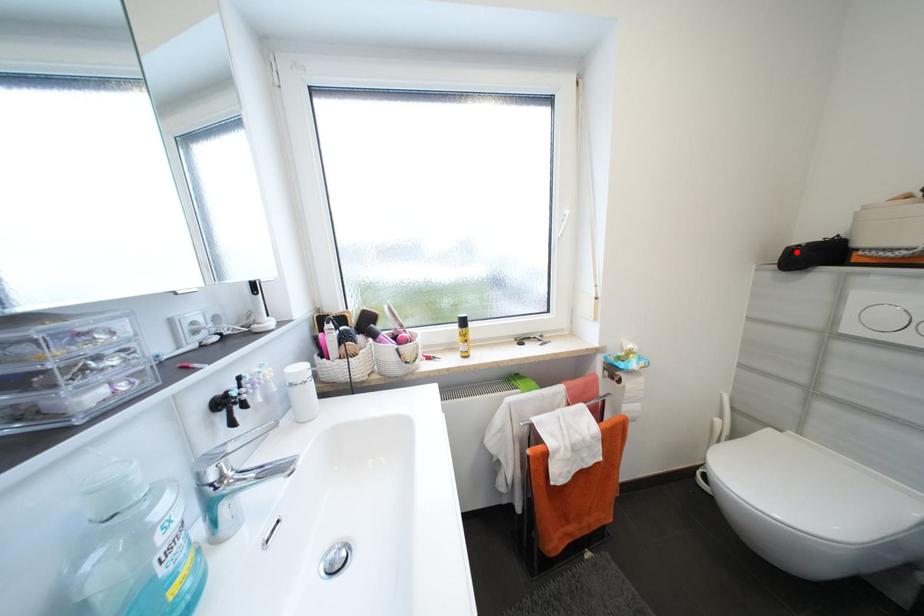
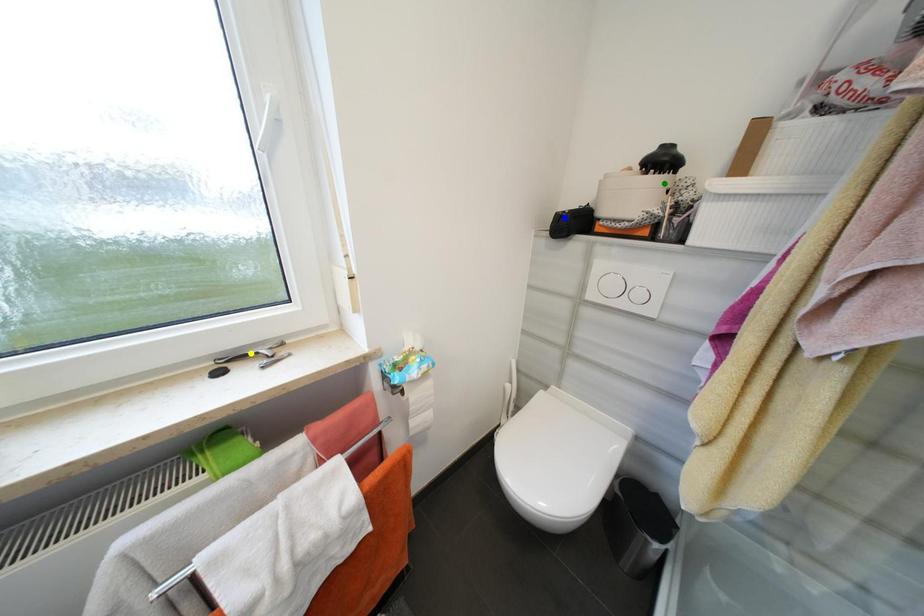
Question: I am providing you with two images of the same scene from different viewpoints. A red point is marked on the first image. You are given multiple points on the second image. Which mark in image 2 goes with the point in image 1?

Choices:
 (A) blue point
 (B) green point
 (C) yellow point

Answer: (A)